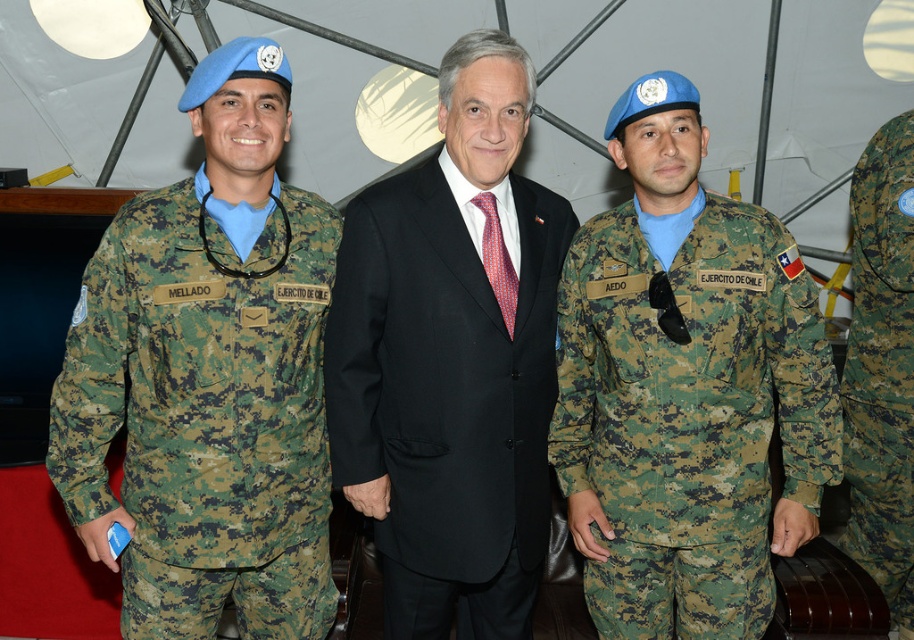
You are standing 5 feet away from the tented structure. There is a point marked at coordinates point (x=213, y=536). Can you reach that point without moving closer than your current position?

The distance of point (x=213, y=536) from viewer is 6.00 feet. Since you are standing 5 feet away, you are already closer than the point, so you can reach it without moving closer.

You are a photographer positioned in front of the tented structure. You need to capture a photo of the camouflage fabric uniform at left and the camouflagetextured fabric at right. Which object should you focus on first if you want to include both in your frame without moving the camera?

The camouflage fabric uniform at left should be focused on first since it is positioned to the left of the camouflagetextured fabric at right, allowing the photographer to frame both by starting from the left side.